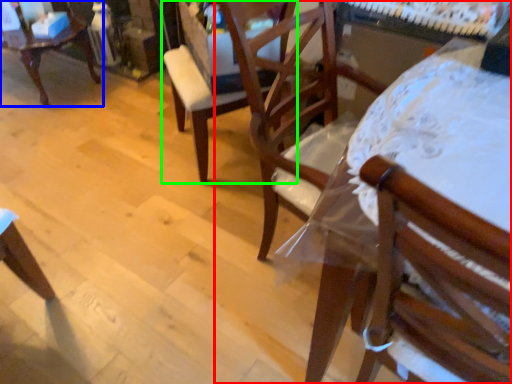
Question: Estimate the real-world distances between objects in this image. Which object is farther from chair (highlighted by a red box), chair (highlighted by a blue box) or chair (highlighted by a green box)?

Choices:
 (A) chair
 (B) chair

Answer: (A)